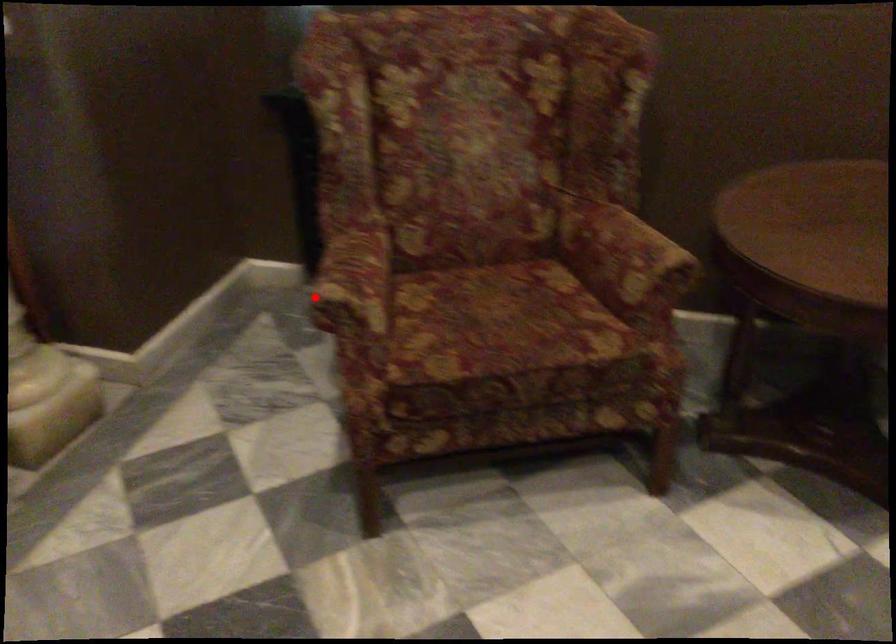
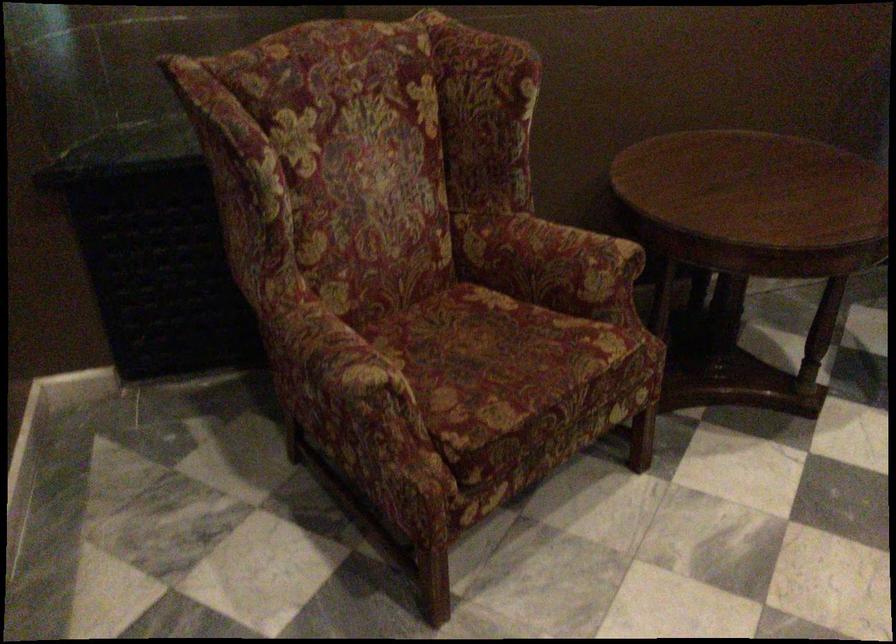
The point at the highlighted location is marked in the first image. Where is the corresponding point in the second image?

(343, 389)